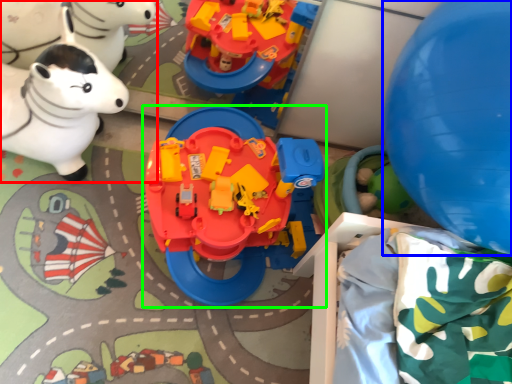
Question: Which object is the closest to the toy (highlighted by a red box)? Choose among these: balloon (highlighted by a blue box) or toy (highlighted by a green box).

Choices:
 (A) balloon
 (B) toy

Answer: (B)